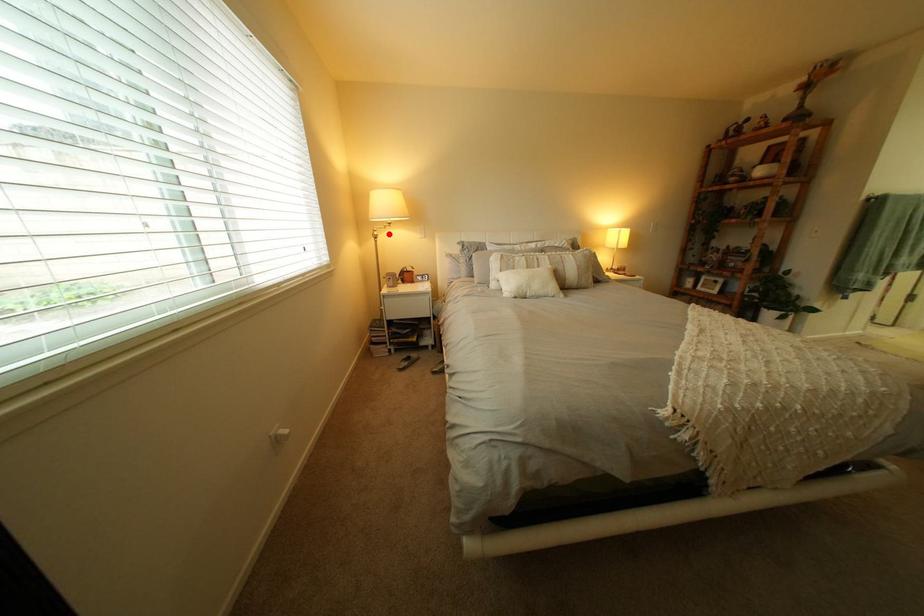
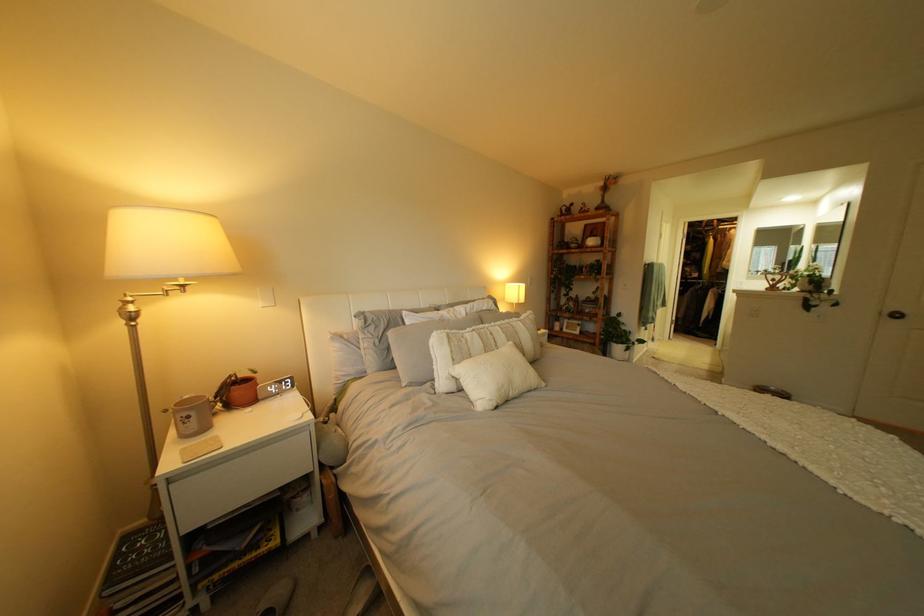
Where in the second image is the point corresponding to the highlighted location from the first image?

(139, 310)